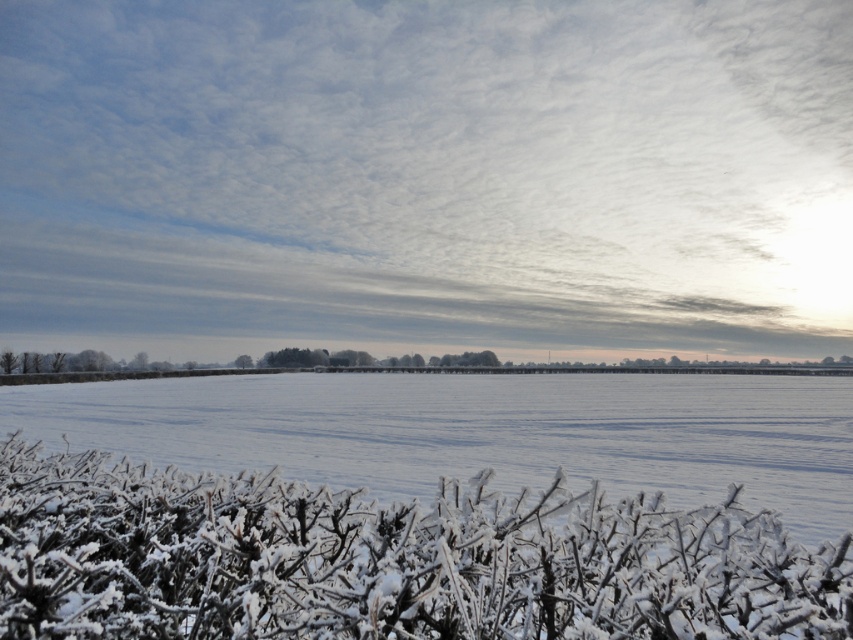
Is point (128, 291) positioned behind point (691, 444)?

Yes.

Does white fluffy cloud at upper center have a greater width compared to white frosty plain at lower center?

Correct, the width of white fluffy cloud at upper center exceeds that of white frosty plain at lower center.

Where is `white fluffy cloud at upper center`? white fluffy cloud at upper center is located at coordinates (427, 179).

This screenshot has width=853, height=640. Identify the location of white frosty bush at lower center. (389, 561).

Can you confirm if white frosty bush at lower center is thinner than white frosty plain at lower center?

Indeed, white frosty bush at lower center has a lesser width compared to white frosty plain at lower center.

Locate an element on the screen. white frosty bush at lower center is located at coordinates (389, 561).

I want to click on white frosty bush at lower center, so click(x=389, y=561).

Can you confirm if white fluffy cloud at upper center is taller than white frosty bush at lower center?

Yes.

Which is above, white fluffy cloud at upper center or white frosty bush at lower center?

Positioned higher is white fluffy cloud at upper center.

Does point (364, 116) come behind point (698, 636)?

Yes, it is.

Where is `white fluffy cloud at upper center`? white fluffy cloud at upper center is located at coordinates (427, 179).